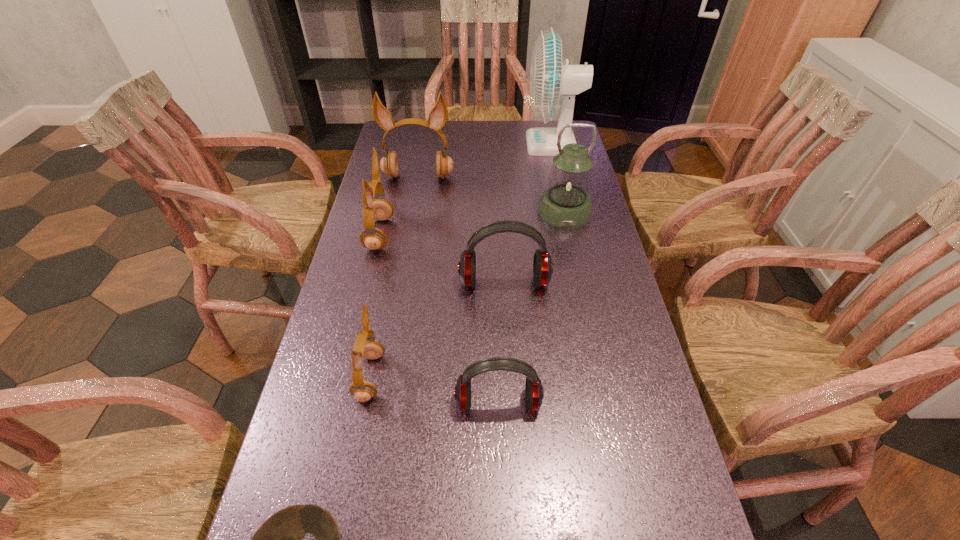
This screenshot has height=540, width=960. Find the location of `the tallest object`. the tallest object is located at coordinates (551, 80).

The width and height of the screenshot is (960, 540). What are the coordinates of `fan` in the screenshot? It's located at (551, 80).

Locate an element on the screen. The width and height of the screenshot is (960, 540). the biggest brown earphone is located at coordinates (438, 116).

Where is `the farthest earphone`? This screenshot has height=540, width=960. the farthest earphone is located at coordinates (438, 116).

What are the coordinates of `greenish lantern` in the screenshot? It's located at (566, 204).

I want to click on the second biggest brown earphone, so click(379, 209).

Where is `the second farthest brown earphone`? The height and width of the screenshot is (540, 960). the second farthest brown earphone is located at coordinates (379, 209).

At what (x,y) coordinates should I click in order to perform the action: click on the fifth nearest object. Please return your answer as a coordinate pair (x, y). Image resolution: width=960 pixels, height=540 pixels. Looking at the image, I should click on (542, 265).

Identify the location of the third nearest earphone. The width and height of the screenshot is (960, 540). (542, 265).

At what (x,y) coordinates should I click in order to perform the action: click on the smallest brown earphone. Please return your answer as a coordinate pair (x, y). The image size is (960, 540). Looking at the image, I should click on (366, 346).